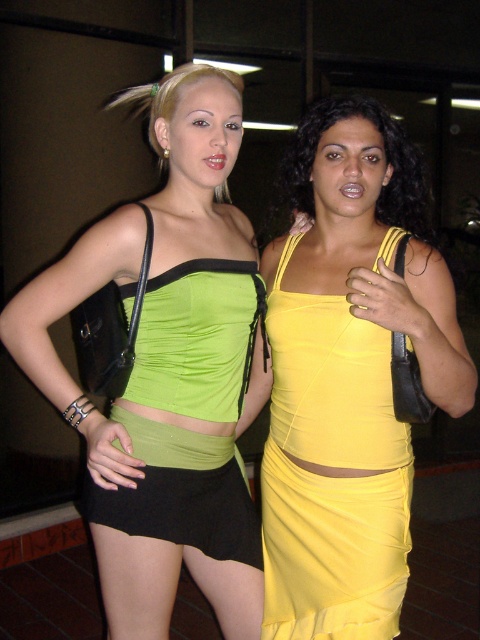
Is green satin dress at center positioned at the back of yellow satin dress at center?

No, green satin dress at center is closer to the viewer.

Who is shorter, green satin dress at center or yellow satin dress at center?

Standing shorter between the two is yellow satin dress at center.

Is point (212, 285) closer to camera compared to point (336, 99)?

Yes, it is in front of point (336, 99).

Find the location of a particular element. The width and height of the screenshot is (480, 640). green satin dress at center is located at coordinates (173, 336).

Does yellow satin dress at right have a lesser width compared to yellow satin dress at center?

Indeed, yellow satin dress at right has a lesser width compared to yellow satin dress at center.

Is yellow satin dress at right above yellow satin dress at center?

No, yellow satin dress at right is not above yellow satin dress at center.

Is point (277, 468) positioned in front of point (408, 211)?

Yes, point (277, 468) is in front of point (408, 211).

At what (x,y) coordinates should I click in order to perform the action: click on yellow satin dress at right. Please return your answer as a coordinate pair (x, y). The height and width of the screenshot is (640, 480). Looking at the image, I should click on (332, 476).

Is green matte fabric top at center below yellow satin dress at right?

Incorrect, green matte fabric top at center is not positioned below yellow satin dress at right.

What do you see at coordinates (166, 371) in the screenshot? The image size is (480, 640). I see `green matte fabric top at center` at bounding box center [166, 371].

The height and width of the screenshot is (640, 480). In order to click on green matte fabric top at center in this screenshot , I will do `click(166, 371)`.